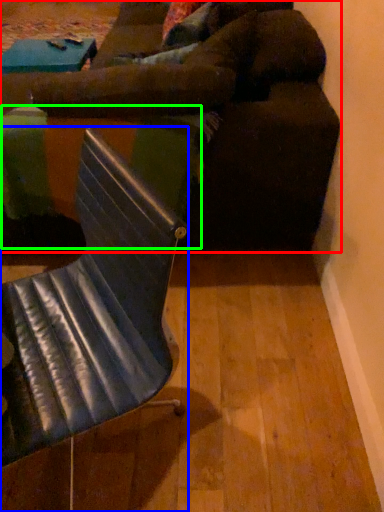
Question: Which object is the closest to the studio couch (highlighted by a red box)? Choose among these: chair (highlighted by a blue box) or table (highlighted by a green box).

Choices:
 (A) chair
 (B) table

Answer: (B)